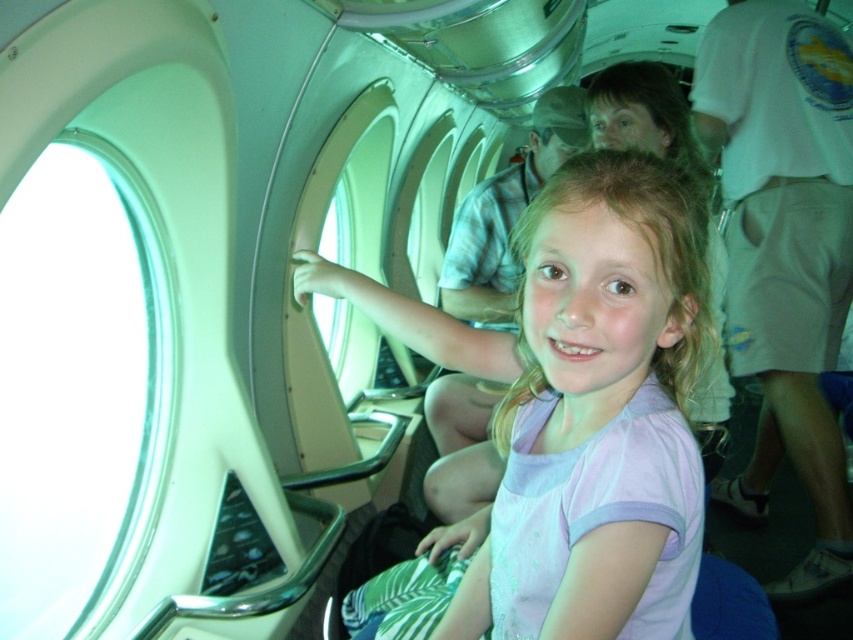
You are a passenger seated in the aircraft cabin and want to look outside through the transparent glass airplane window at left. Based on the coordinates provided, can you determine if the window is positioned to your left side?

The transparent glass airplane window at left is located at coordinates (79, 392). Since the x coordinate is 0.614, which is closer to the left side of the image, the window is positioned to your left side.

You are a passenger seated in the aircraft cabin. You notice a point marked at coordinates (79, 392). What object is located at that point?

The point at (79, 392) marks the transparent glass airplane window at left.

You are a passenger on this airplane and want to know which object takes up more area in your view. Based on the scene, which one is larger between the transparent glass airplane window at left and the pink fabric shirt at center?

The pink fabric shirt at center takes up more area in the view because the transparent glass airplane window at left occupies less space than pink fabric shirt at center.